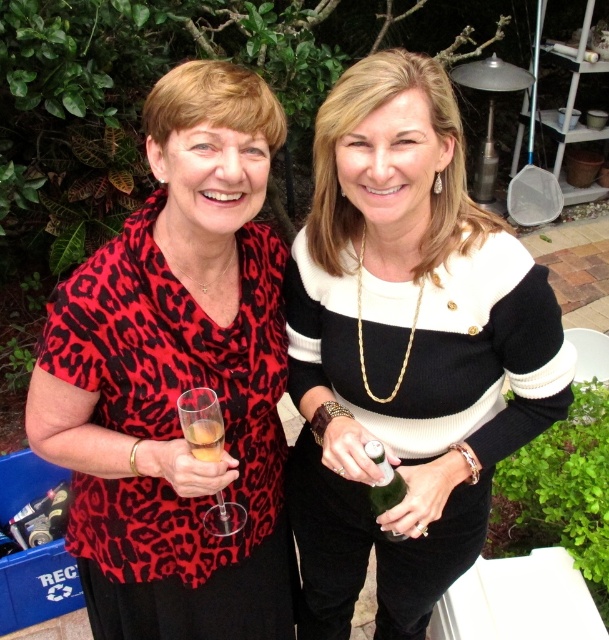
Does black and white sweater at center appear on the left side of green glass bottle at center?

No, black and white sweater at center is not to the left of green glass bottle at center.

Can you confirm if black and white sweater at center is shorter than green glass bottle at center?

Incorrect, black and white sweater at center's height does not fall short of green glass bottle at center's.

This screenshot has width=609, height=640. Describe the element at coordinates (406, 349) in the screenshot. I see `black and white sweater at center` at that location.

What are the coordinates of `black and white sweater at center` in the screenshot? It's located at [406, 349].

Is black and white sweater at center smaller than clear glass wine glass at center?

No.

Between black and white sweater at center and clear glass wine glass at center, which one appears on the left side from the viewer's perspective?

clear glass wine glass at center

Is point (367, 424) behind point (216, 524)?

Yes, it is behind point (216, 524).

Locate an element on the screen. The width and height of the screenshot is (609, 640). black and white sweater at center is located at coordinates (406, 349).

Is point (404, 493) closer to camera compared to point (216, 445)?

No.

I want to click on green glass bottle at center, so click(x=384, y=481).

At what (x,y) coordinates should I click in order to perform the action: click on green glass bottle at center. Please return your answer as a coordinate pair (x, y). This screenshot has height=640, width=609. Looking at the image, I should click on (384, 481).